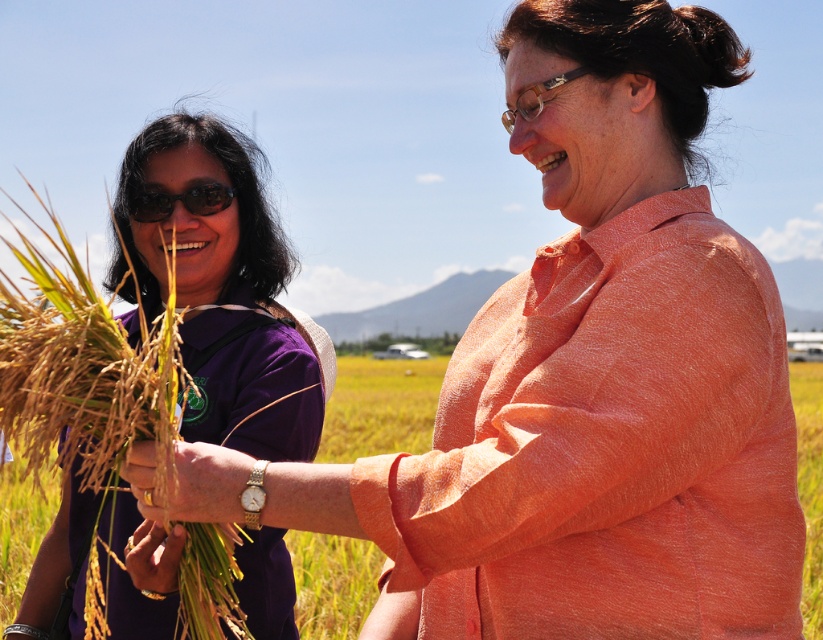
Question: Can you confirm if purple fabric shirt at left is thinner than matte black sunglasses at left?

Choices:
 (A) no
 (B) yes

Answer: (A)

Question: Which point appears closest to the camera in this image?

Choices:
 (A) (194, 241)
 (B) (152, 218)

Answer: (A)

Question: Is purple fabric shirt at left above matte black sunglasses at left?

Choices:
 (A) no
 (B) yes

Answer: (A)

Question: Observing the image, what is the correct spatial positioning of purple fabric shirt at left in reference to matte black sunglasses at left?

Choices:
 (A) above
 (B) below

Answer: (B)